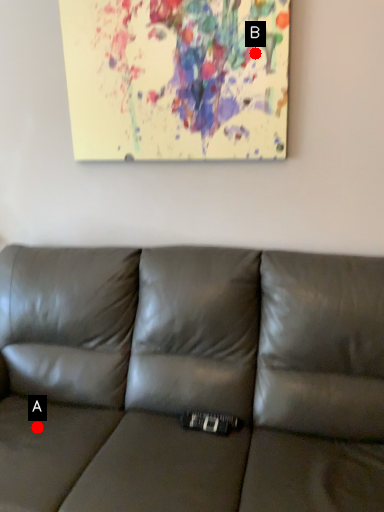
Question: Two points are circled on the image, labeled by A and B beside each circle. Which point is closer to the camera?

Choices:
 (A) A is closer
 (B) B is closer

Answer: (A)